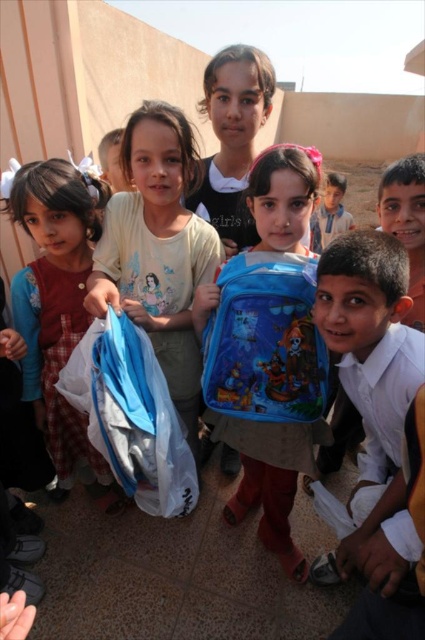
You are standing at point (56, 298) in the image. What color is the dress located to your left?

The dress to the left is matte red.

You are a photographer trying to focus on the matte red dress at left and the smooth brown hair at center. Which one should you adjust your camera to focus on first if you want to capture both in the same frame?

You should focus on the matte red dress at left first because it is closer to the camera than the smooth brown hair at center, allowing you to adjust the depth of field to include both in the frame.